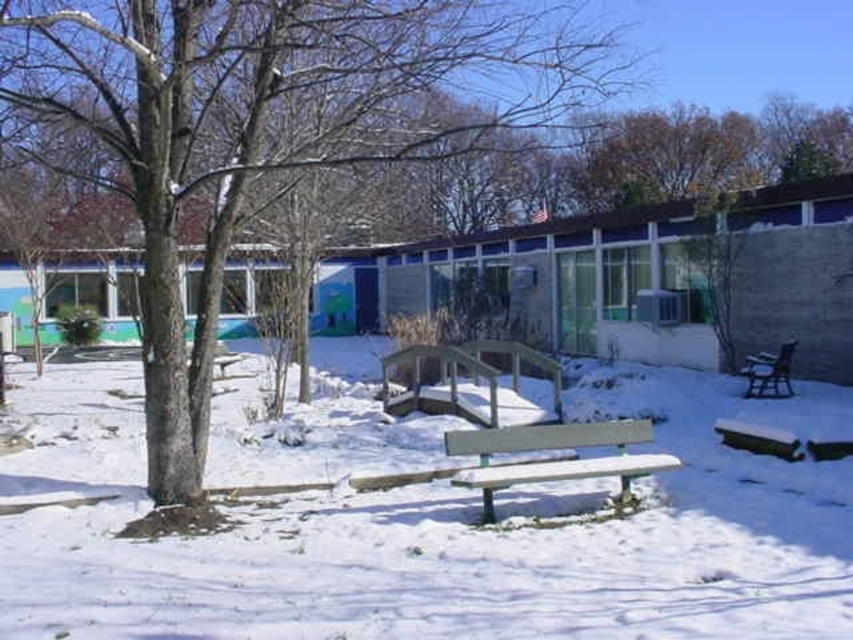
Does white matte snow at center appear on the left side of brown rough tree at center?

No, white matte snow at center is not to the left of brown rough tree at center.

Who is shorter, white matte snow at center or brown rough tree at center?

white matte snow at center is shorter.

What do you see at coordinates (432, 538) in the screenshot? I see `white matte snow at center` at bounding box center [432, 538].

The image size is (853, 640). I want to click on white matte snow at center, so click(x=432, y=538).

Who is lower down, brown rough tree at center or light brown wood bench at center?

light brown wood bench at center is lower down.

Is point (543, 109) positioned in front of point (465, 436)?

Yes.

You are a GUI agent. You are given a task and a screenshot of the screen. Output one action in this format:
    pyautogui.click(x=<x>, y=<y>)
    Task: Click on the brown rough tree at center
    The width and height of the screenshot is (853, 640).
    Given the screenshot: What is the action you would take?
    pyautogui.click(x=270, y=128)

Looking at this image, which of these two, white matte snow at center or light brown wood bench at center, stands shorter?

With less height is light brown wood bench at center.

Based on the photo, can you confirm if white matte snow at center is taller than light brown wood bench at center?

Yes, white matte snow at center is taller than light brown wood bench at center.

Identify the location of white matte snow at center. tap(432, 538).